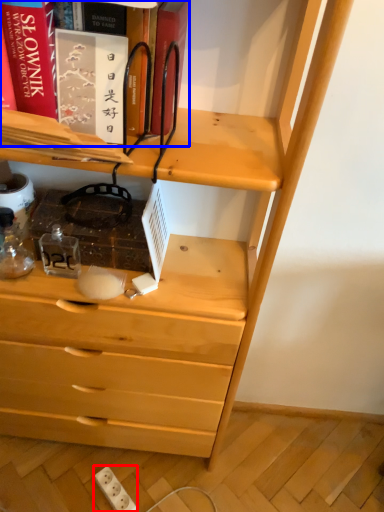
Question: Which point is closer to the camera, electric outlet (highlighted by a red box) or book (highlighted by a blue box)?

Choices:
 (A) electric outlet
 (B) book

Answer: (B)